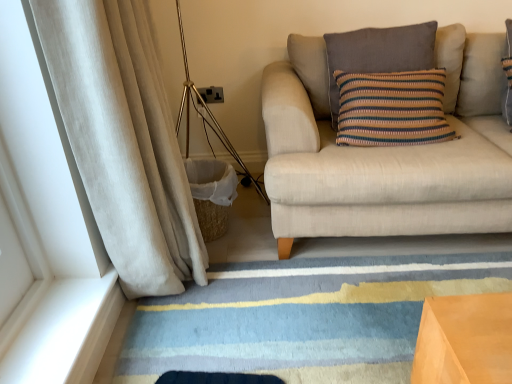
Where is `knitted cotton pillow at upper right`? This screenshot has height=384, width=512. knitted cotton pillow at upper right is located at coordinates (378, 54).

Based on the photo, what is the approximate width of striped wool rug at lower center?

striped wool rug at lower center is 4.82 feet in width.

The height and width of the screenshot is (384, 512). Find the location of `knitted cotton pillow at upper right`. knitted cotton pillow at upper right is located at coordinates (378, 54).

Where is `curtain on the left of striped wool rug at lower center`? The image size is (512, 384). curtain on the left of striped wool rug at lower center is located at coordinates (124, 139).

Based on the photo, from a real-world perspective, is beige corduroy curtain at left physically located above or below striped wool rug at lower center?

beige corduroy curtain at left is situated higher than striped wool rug at lower center in the real world.

Can striped wool rug at lower center be found inside beige corduroy curtain at left?

Actually, striped wool rug at lower center is outside beige corduroy curtain at left.

Can you confirm if knitted cotton pillow at upper right is wider than gold metallic tripod lamp at left?

No, knitted cotton pillow at upper right is not wider than gold metallic tripod lamp at left.

Is knitted cotton pillow at upper right looking in the opposite direction of gold metallic tripod lamp at left?

knitted cotton pillow at upper right is not turned away from gold metallic tripod lamp at left.

Where is `pillow located behind the gold metallic tripod lamp at left`? pillow located behind the gold metallic tripod lamp at left is located at coordinates pyautogui.click(x=378, y=54).

Looking at the image, does knitted cotton pillow at upper right seem bigger or smaller compared to gold metallic tripod lamp at left?

Considering their sizes, knitted cotton pillow at upper right takes up less space than gold metallic tripod lamp at left.

Would you say knitted cotton pillow at upper right is part of beige fabric couch at right's contents?

Yes, knitted cotton pillow at upper right is inside beige fabric couch at right.

Considering the relative sizes of beige fabric couch at right and knitted cotton pillow at upper right in the image provided, is beige fabric couch at right shorter than knitted cotton pillow at upper right?

No, beige fabric couch at right is not shorter than knitted cotton pillow at upper right.

Considering the sizes of objects beige fabric couch at right and knitted cotton pillow at upper right in the image provided, who is bigger, beige fabric couch at right or knitted cotton pillow at upper right?

Bigger between the two is beige fabric couch at right.

Considering the positions of objects beige corduroy curtain at left and gold metallic tripod lamp at left in the image provided, who is in front, beige corduroy curtain at left or gold metallic tripod lamp at left?

beige corduroy curtain at left is more forward.

From a real-world perspective, is beige corduroy curtain at left over gold metallic tripod lamp at left?

Indeed, from a real-world perspective, beige corduroy curtain at left stands above gold metallic tripod lamp at left.

Is beige corduroy curtain at left smaller than gold metallic tripod lamp at left?

Yes.

From the picture: Which object is thinner, beige fabric couch at right or striped wool rug at lower center?

With smaller width is beige fabric couch at right.

Is beige fabric couch at right in front of or behind striped wool rug at lower center in the image?

beige fabric couch at right is positioned farther from the viewer than striped wool rug at lower center.

Is beige fabric couch at right spatially inside striped wool rug at lower center, or outside of it?

beige fabric couch at right is outside striped wool rug at lower center.

From the image's perspective, is beige fabric couch at right on top of beige corduroy curtain at left?

Indeed, from the image's perspective, beige fabric couch at right is shown above beige corduroy curtain at left.

Which object is further away from the camera, beige fabric couch at right or beige corduroy curtain at left?

Positioned behind is beige fabric couch at right.

Consider the image. Is beige fabric couch at right spatially inside beige corduroy curtain at left, or outside of it?

beige fabric couch at right is not inside beige corduroy curtain at left, it's outside.

Is beige fabric couch at right facing towards beige corduroy curtain at left?

No.

Which of these two, gold metallic tripod lamp at left or knitted cotton pillow at upper right, stands taller?

gold metallic tripod lamp at left.

Could you tell me if gold metallic tripod lamp at left is facing knitted cotton pillow at upper right?

No, gold metallic tripod lamp at left is not aimed at knitted cotton pillow at upper right.

Is gold metallic tripod lamp at left thinner than knitted cotton pillow at upper right?

No.

Is knitted cotton pillow at upper right completely or partially inside gold metallic tripod lamp at left?

No, knitted cotton pillow at upper right is not a part of gold metallic tripod lamp at left.

This screenshot has height=384, width=512. Find the location of `curtain positioned vertically above the striped wool rug at lower center (from a real-world perspective)`. curtain positioned vertically above the striped wool rug at lower center (from a real-world perspective) is located at coordinates (124, 139).

The height and width of the screenshot is (384, 512). What are the coordinates of `lamp located underneath the knitted cotton pillow at upper right (from a real-world perspective)` in the screenshot? It's located at [208, 115].

Based on their spatial positions, is beige corduroy curtain at left or knitted cotton pillow at upper right further from striped wool rug at lower center?

knitted cotton pillow at upper right.

Based on their spatial positions, is striped wool rug at lower center or beige fabric couch at right further from beige corduroy curtain at left?

The object further to beige corduroy curtain at left is beige fabric couch at right.

Estimate the real-world distances between objects in this image. Which object is further from striped wool rug at lower center, beige fabric couch at right or beige corduroy curtain at left?

beige corduroy curtain at left.

Estimate the real-world distances between objects in this image. Which object is closer to gold metallic tripod lamp at left, beige fabric couch at right or knitted cotton pillow at upper right?

The object closer to gold metallic tripod lamp at left is beige fabric couch at right.

Considering their positions, is striped wool rug at lower center positioned further to beige fabric couch at right than beige corduroy curtain at left?

beige corduroy curtain at left.

Looking at the image, which one is located closer to knitted cotton pillow at upper right, beige corduroy curtain at left or striped wool rug at lower center?

striped wool rug at lower center.

Looking at the image, which one is located closer to beige fabric couch at right, knitted cotton pillow at upper right or striped wool rug at lower center?

knitted cotton pillow at upper right is positioned closer to the anchor beige fabric couch at right.

Which object lies further to the anchor point beige fabric couch at right, beige corduroy curtain at left or striped wool rug at lower center?

beige corduroy curtain at left.

Where is `doormat between beige corduroy curtain at left and beige fabric couch at right`? This screenshot has width=512, height=384. doormat between beige corduroy curtain at left and beige fabric couch at right is located at coordinates (301, 314).

The height and width of the screenshot is (384, 512). I want to click on pillow between gold metallic tripod lamp at left and beige fabric couch at right from left to right, so click(x=378, y=54).

The width and height of the screenshot is (512, 384). I want to click on studio couch between knitted cotton pillow at upper right and striped wool rug at lower center in the vertical direction, so click(x=387, y=152).

Find the location of `curtain between knitted cotton pillow at upper right and striped wool rug at lower center in the up-down direction`. curtain between knitted cotton pillow at upper right and striped wool rug at lower center in the up-down direction is located at coordinates (124, 139).